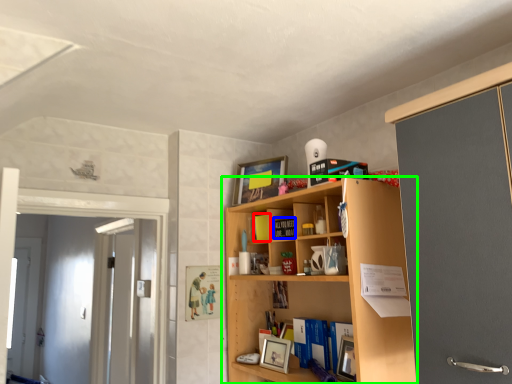
Question: Estimate the real-world distances between objects in this image. Which object is farther from book (highlighted by a red box), book (highlighted by a blue box) or shelf (highlighted by a green box)?

Choices:
 (A) book
 (B) shelf

Answer: (B)